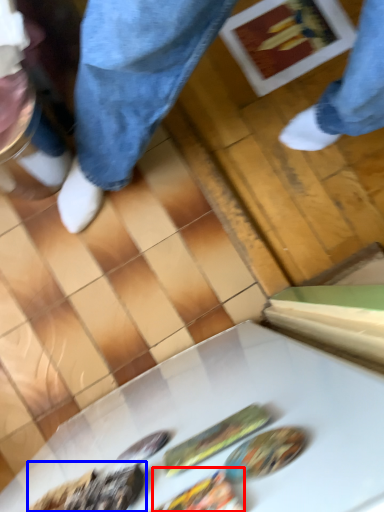
Question: Which of the following is the farthest to the observer, food (highlighted by a red box) or food (highlighted by a blue box)?

Choices:
 (A) food
 (B) food

Answer: (B)